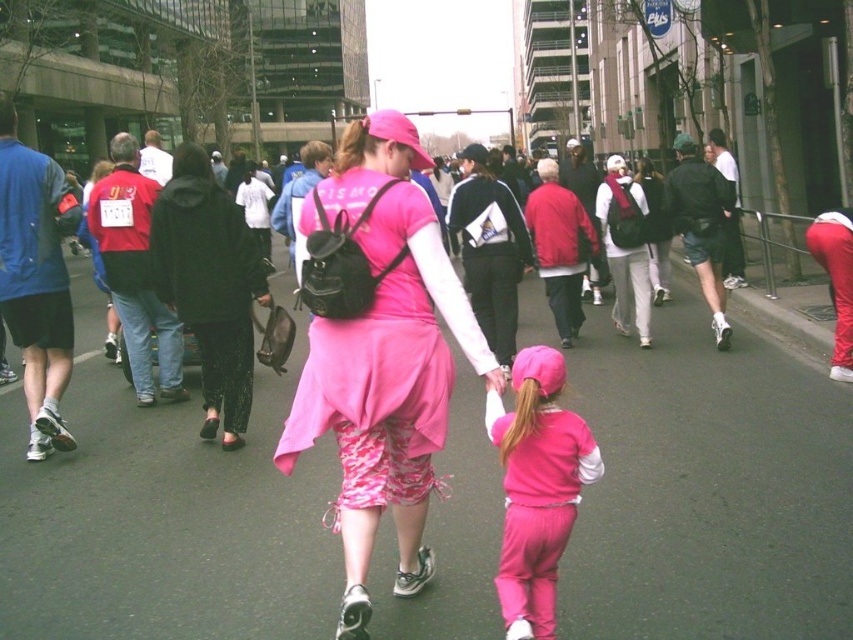
Question: In this image, where is matte pink dress at center located relative to pink fleece pants at center?

Choices:
 (A) above
 (B) below

Answer: (A)

Question: Does matte pink dress at center have a larger size compared to pink fleece pants at center?

Choices:
 (A) yes
 (B) no

Answer: (A)

Question: Which point is farther to the camera?

Choices:
 (A) pink fleece pants at center
 (B) matte pink dress at center

Answer: (B)

Question: Which point appears closest to the camera in this image?

Choices:
 (A) (403, 449)
 (B) (544, 428)

Answer: (B)

Question: Can you confirm if matte pink dress at center is smaller than pink fleece pants at center?

Choices:
 (A) yes
 (B) no

Answer: (B)